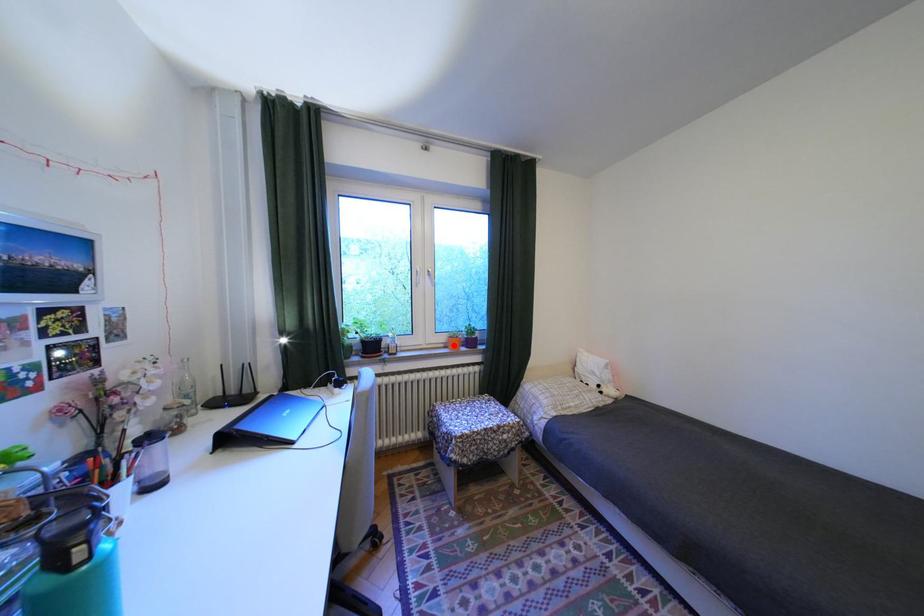
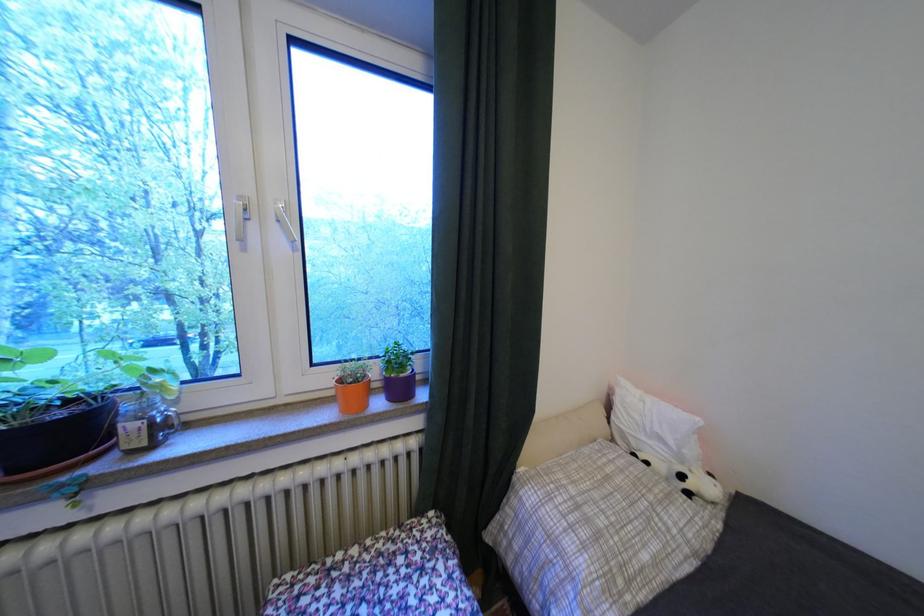
Locate, in the second image, the point that corresponds to the highlighted location in the first image.

(343, 392)